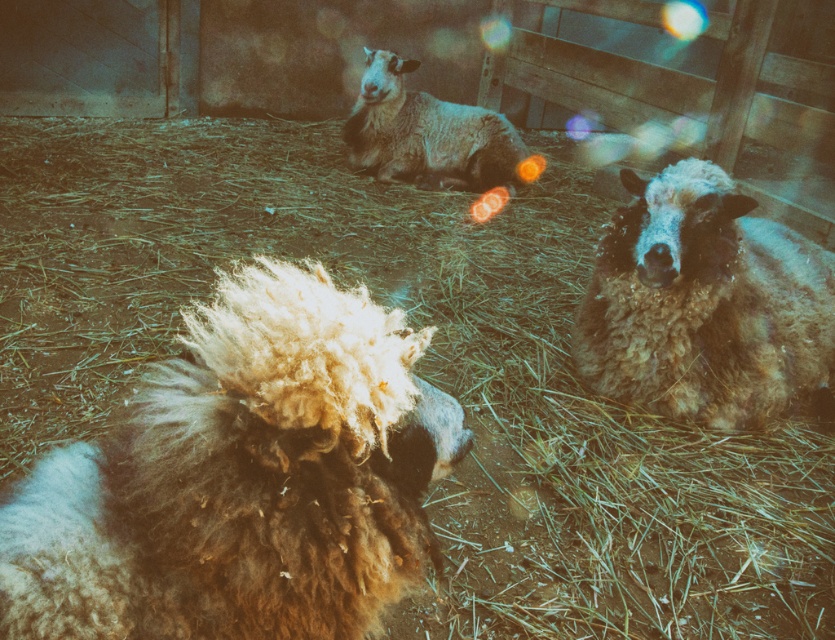
Between point (281, 292) and point (439, 148), which one is positioned in front?

Point (281, 292) is more forward.

Who is higher up, fluffy brown wool at center or fuzzy woolen sheep at center?

Positioned higher is fuzzy woolen sheep at center.

Which is in front, point (343, 339) or point (419, 97)?

Point (343, 339)

Find the location of `fluffy brown wool at center`. fluffy brown wool at center is located at coordinates (241, 477).

Who is more forward, (287, 589) or (646, 259)?

Point (287, 589) is more forward.

Where is `fluffy brown wool at center`? This screenshot has height=640, width=835. fluffy brown wool at center is located at coordinates (241, 477).

Does fuzzy brown sheep at center appear on the left side of fuzzy woolen sheep at center?

No, fuzzy brown sheep at center is not to the left of fuzzy woolen sheep at center.

Between fuzzy brown sheep at center and fuzzy woolen sheep at center, which one has less height?

fuzzy woolen sheep at center is shorter.

Between point (828, 346) and point (458, 141), which one is positioned behind?

Point (458, 141)

Identify the location of fuzzy brown sheep at center. (704, 305).